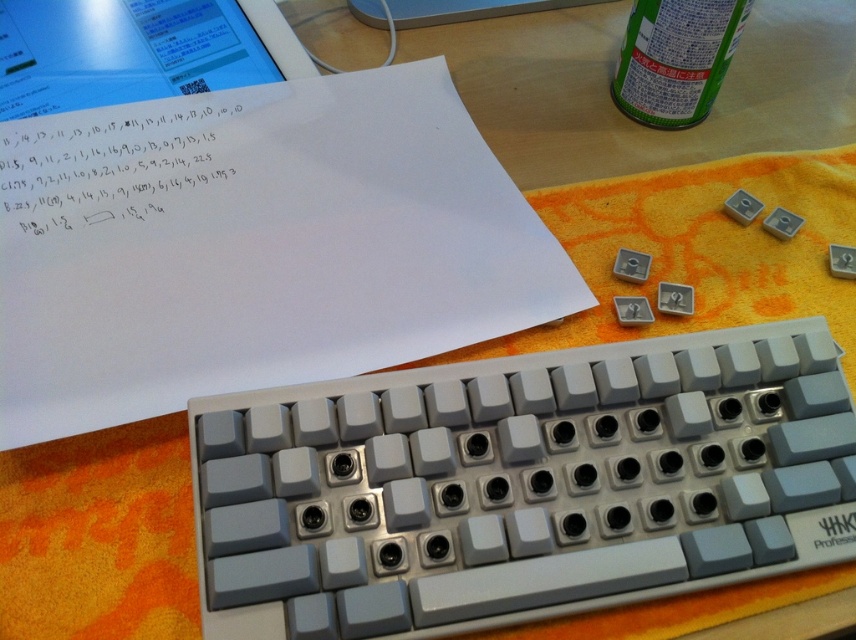
Question: Does white plastic keyboard at center have a lesser width compared to white paper at upper left?

Choices:
 (A) yes
 (B) no

Answer: (A)

Question: Which point is closer to the camera taking this photo?

Choices:
 (A) (623, 83)
 (B) (473, 612)

Answer: (B)

Question: Which object is positioned farthest from the green matte can at upper right?

Choices:
 (A) white plastic keyboard at center
 (B) white paper at upper left

Answer: (A)

Question: Is the position of white paper at upper left more distant than that of green matte can at upper right?

Choices:
 (A) no
 (B) yes

Answer: (A)

Question: Can you confirm if white paper at upper left is wider than green matte can at upper right?

Choices:
 (A) no
 (B) yes

Answer: (B)

Question: Based on their relative distances, which object is farther from the green matte can at upper right?

Choices:
 (A) white plastic keyboard at center
 (B) white paper at upper left

Answer: (A)